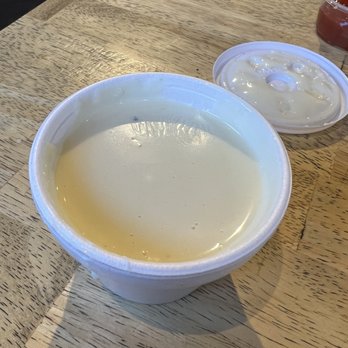
Locate an element on the screen. The height and width of the screenshot is (348, 348). shadow of white cup is located at coordinates (212, 313).